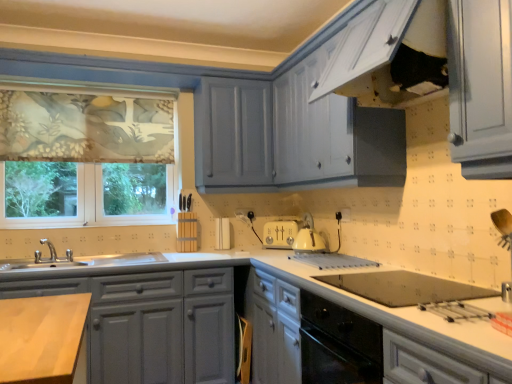
Question: Can you confirm if matte gray cabinets at lower left, which ranks as the 2th cabinetry in right-to-left order, is taller than white glossy oven at lower center, which ranks as the 1th cabinetry in right-to-left order?

Choices:
 (A) no
 (B) yes

Answer: (A)

Question: Is matte gray cabinets at lower left, placed as the first cabinetry when sorted from left to right, beside white glossy oven at lower center, which ranks as the 1th cabinetry in right-to-left order?

Choices:
 (A) no
 (B) yes

Answer: (A)

Question: Does matte gray cabinets at lower left, which ranks as the 2th cabinetry in right-to-left order, have a smaller size compared to white glossy oven at lower center, which is the second cabinetry in left-to-right order?

Choices:
 (A) yes
 (B) no

Answer: (A)

Question: Is matte gray cabinets at lower left, which ranks as the 2th cabinetry in right-to-left order, far from white glossy oven at lower center, which is the second cabinetry in left-to-right order?

Choices:
 (A) yes
 (B) no

Answer: (B)

Question: Is matte gray cabinets at lower left, placed as the first cabinetry when sorted from left to right, shorter than white glossy oven at lower center, which is the second cabinetry in left-to-right order?

Choices:
 (A) yes
 (B) no

Answer: (A)

Question: From a real-world perspective, is floral fabric window at left above or below matte gray cabinets at lower left, which ranks as the 2th cabinetry in right-to-left order?

Choices:
 (A) above
 (B) below

Answer: (A)

Question: Looking at their shapes, would you say floral fabric window at left is wider or thinner than matte gray cabinets at lower left, which ranks as the 2th cabinetry in right-to-left order?

Choices:
 (A) wide
 (B) thin

Answer: (B)

Question: Is point (122, 221) positioned closer to the camera than point (201, 324)?

Choices:
 (A) closer
 (B) farther

Answer: (B)

Question: From the image's perspective, is floral fabric window at left positioned above or below matte gray cabinets at lower left, which ranks as the 2th cabinetry in right-to-left order?

Choices:
 (A) below
 (B) above

Answer: (B)

Question: Is white glossy oven at lower center, which ranks as the 1th cabinetry in right-to-left order, taller or shorter than matte gray cabinets at lower left, which ranks as the 2th cabinetry in right-to-left order?

Choices:
 (A) short
 (B) tall

Answer: (B)

Question: From a real-world perspective, is white glossy oven at lower center, which is the second cabinetry in left-to-right order, above or below matte gray cabinets at lower left, which ranks as the 2th cabinetry in right-to-left order?

Choices:
 (A) above
 (B) below

Answer: (A)

Question: From the image's perspective, is white glossy oven at lower center, which is the second cabinetry in left-to-right order, positioned above or below matte gray cabinets at lower left, placed as the first cabinetry when sorted from left to right?

Choices:
 (A) above
 (B) below

Answer: (A)

Question: Considering the positions of point (280, 269) and point (165, 337), is point (280, 269) closer or farther from the camera than point (165, 337)?

Choices:
 (A) closer
 (B) farther

Answer: (A)

Question: Is point (214, 296) positioned closer to the camera than point (370, 314)?

Choices:
 (A) closer
 (B) farther

Answer: (B)

Question: Do you think matte gray cabinets at lower left, placed as the first cabinetry when sorted from left to right, is within white glossy oven at lower center, which ranks as the 1th cabinetry in right-to-left order, or outside of it?

Choices:
 (A) inside
 (B) outside

Answer: (B)